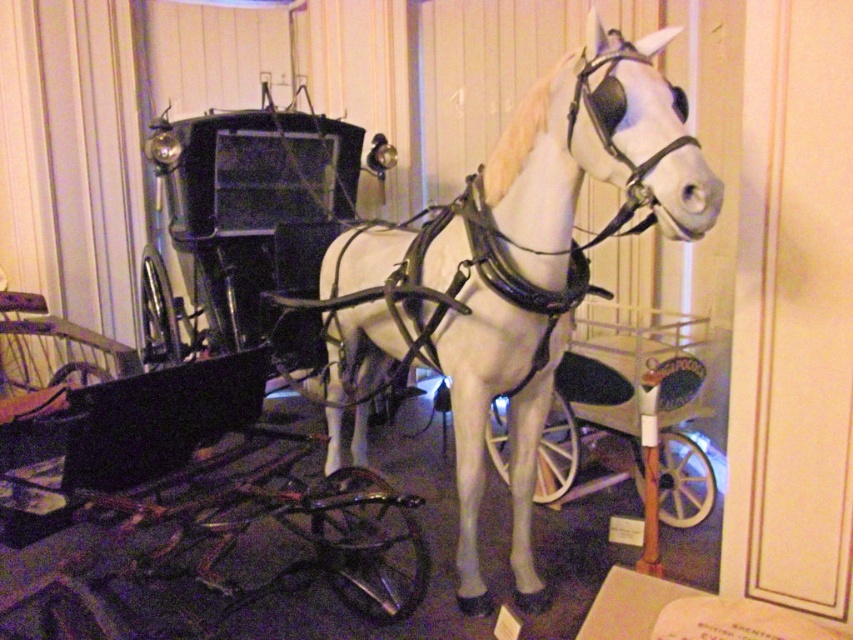
Question: Which object appears farthest from the camera in this image?

Choices:
 (A) white glossy horse at center
 (B) metallic silver cart at center

Answer: (B)

Question: Considering the relative positions of white glossy horse at center and metallic silver cart at center in the image provided, where is white glossy horse at center located with respect to metallic silver cart at center?

Choices:
 (A) left
 (B) right

Answer: (A)

Question: Is white glossy horse at center below metallic silver cart at center?

Choices:
 (A) yes
 (B) no

Answer: (B)

Question: Can you confirm if white glossy horse at center is positioned to the right of metallic silver cart at center?

Choices:
 (A) no
 (B) yes

Answer: (A)

Question: Which object appears closest to the camera in this image?

Choices:
 (A) metallic silver cart at center
 (B) white glossy horse at center

Answer: (B)